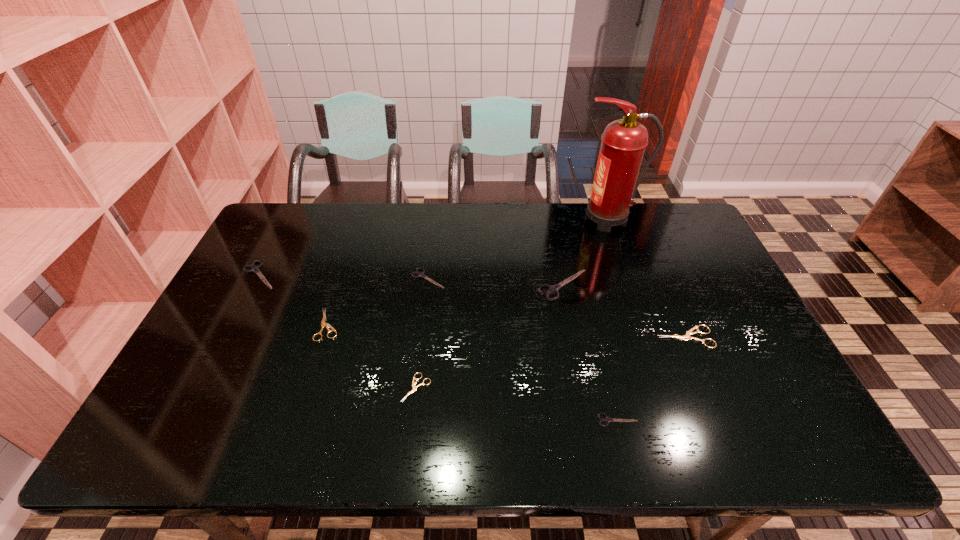
Where is `the second biggest beige shears`? the second biggest beige shears is located at coordinates (323, 324).

Locate an element on the screen. the smallest black shears is located at coordinates (606, 419).

You are a GUI agent. You are given a task and a screenshot of the screen. Output one action in this format:
    pyautogui.click(x=<x>, y=<y>)
    Task: Click on the nearest shears
    Image resolution: width=960 pixels, height=540 pixels.
    Given the screenshot: What is the action you would take?
    pyautogui.click(x=606, y=419)

In order to click on the nearest beige shears in this screenshot , I will do pyautogui.click(x=414, y=388).

At what (x,y) coordinates should I click in order to perform the action: click on the shortest object. Please return your answer as a coordinate pair (x, y). Looking at the image, I should click on (414, 388).

At what (x,y) coordinates should I click in order to perform the action: click on free location located 0.300m on the front-facing side of the farthest object. Please return your answer as a coordinate pair (x, y). This screenshot has width=960, height=540. Looking at the image, I should click on (491, 220).

At what (x,y) coordinates should I click in order to perform the action: click on free spot located on the front-facing side of the farthest object. Please return your answer as a coordinate pair (x, y). The image size is (960, 540). Looking at the image, I should click on (468, 220).

Locate an element on the screen. This screenshot has width=960, height=540. vacant space situated on the front-facing side of the farthest object is located at coordinates (479, 220).

Image resolution: width=960 pixels, height=540 pixels. I want to click on vacant space located on the right of the biggest black shears, so click(655, 285).

Where is `vacant position located 0.340m on the front of the leftmost black shears`? vacant position located 0.340m on the front of the leftmost black shears is located at coordinates (201, 388).